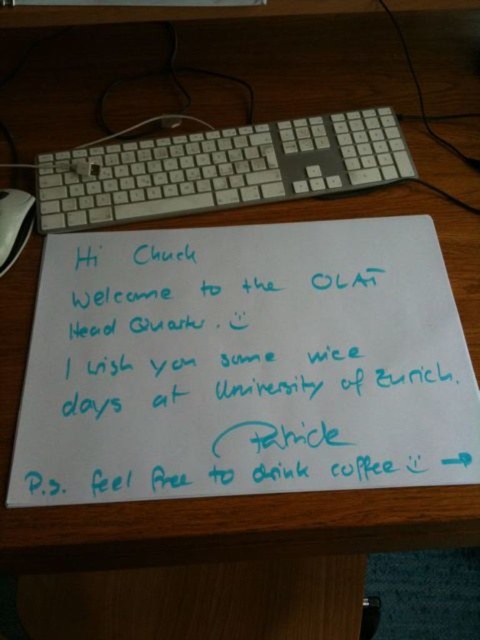
Between white paper at center and black plastic mouse at lower left, which one is positioned lower?

Positioned lower is white paper at center.

What do you see at coordinates (243, 364) in the screenshot?
I see `white paper at center` at bounding box center [243, 364].

I want to click on white paper at center, so click(x=243, y=364).

Is white paper at center taller than white plastic keyboard at upper center?

Yes.

Between point (368, 332) and point (299, 145), which one is positioned in front?

Point (368, 332) is in front.

The width and height of the screenshot is (480, 640). Find the location of `white paper at center`. white paper at center is located at coordinates (243, 364).

How much distance is there between white plastic keyboard at upper center and black plastic mouse at lower left?

The distance of white plastic keyboard at upper center from black plastic mouse at lower left is 19.56 centimeters.

Looking at this image, is white plastic keyboard at upper center bigger than black plastic mouse at lower left?

Correct, white plastic keyboard at upper center is larger in size than black plastic mouse at lower left.

The width and height of the screenshot is (480, 640). Describe the element at coordinates (220, 170) in the screenshot. I see `white plastic keyboard at upper center` at that location.

Identify the location of white plastic keyboard at upper center. (220, 170).